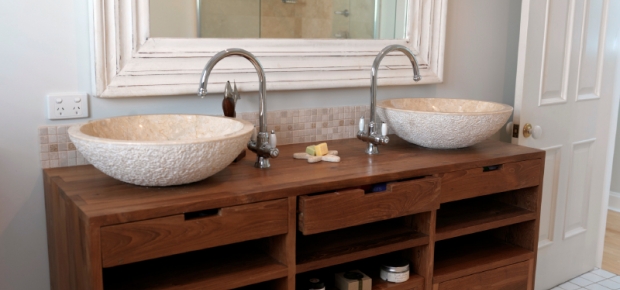
Locate an element on the screen. light brown hardwood floor is located at coordinates (612, 254).